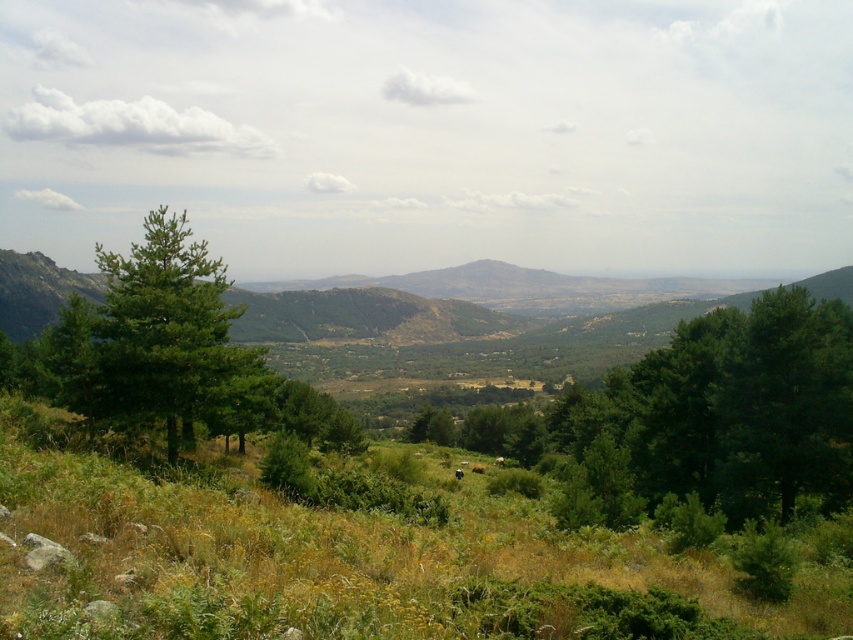
Can you confirm if green matte tree at left is positioned to the right of brown furry cow at center?

No, green matte tree at left is not to the right of brown furry cow at center.

Between green matte tree at left and brown furry cow at center, which one appears on the left side from the viewer's perspective?

green matte tree at left

Measure the distance between green matte tree at left and camera.

green matte tree at left is 24.15 meters away from camera.

You are a GUI agent. You are given a task and a screenshot of the screen. Output one action in this format:
    pyautogui.click(x=<x>, y=<y>)
    Task: Click on the green matte tree at left
    The image size is (853, 640).
    Given the screenshot: What is the action you would take?
    pyautogui.click(x=173, y=339)

Between green grassy field at center and brown furry cow at center, which one has less height?

Standing shorter between the two is brown furry cow at center.

Does point (379, 536) come farther from viewer compared to point (479, 467)?

That is False.

The width and height of the screenshot is (853, 640). I want to click on green grassy field at center, so click(x=360, y=554).

Does green grassy field at center have a greater height compared to green matte tree at left?

Correct, green grassy field at center is much taller as green matte tree at left.

What do you see at coordinates (360, 554) in the screenshot?
I see `green grassy field at center` at bounding box center [360, 554].

Does point (70, 518) lie behind point (248, 394)?

No, (70, 518) is closer to viewer.

This screenshot has height=640, width=853. In order to click on green grassy field at center in this screenshot , I will do `click(360, 554)`.